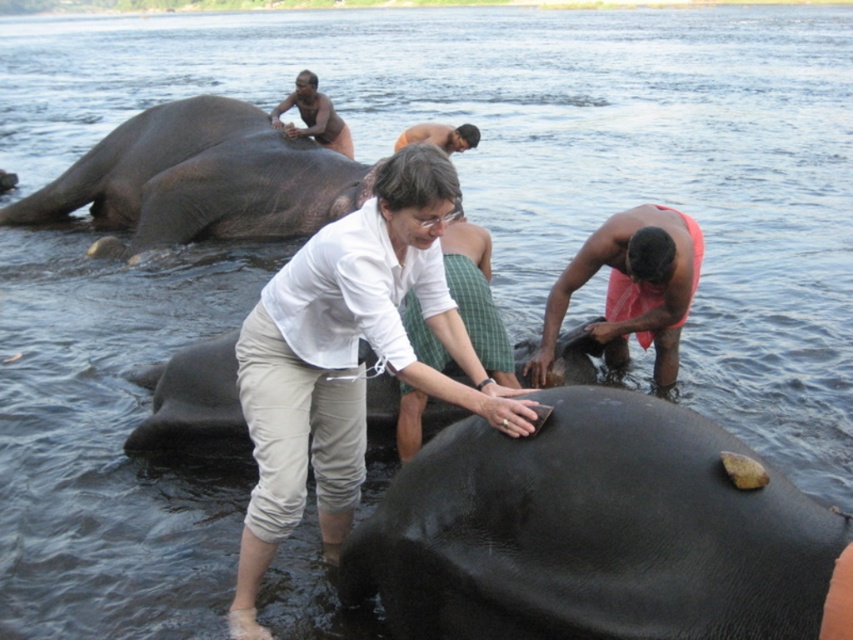
You are standing at the point labeled as point (276, 228) in the image. You want to move 5 meters forward. Will you still be within the scene depicted in the image?

The distance of point (276, 228) from viewer is 12.23 meters. Moving 5 meters forward would place you at 7.23 meters from the original viewpoint. Since the scene includes elements like the river, elephants, and people at varying distances, it is likely that moving 5 meters forward from point (276, 228) would still keep you within the depicted scene as the total depth seems sufficient.

You are a photographer trying to capture a photo of the shiny black skin at center and the brown skin man at upper center. Which subject should you zoom in more on to ensure both are in focus, considering their sizes?

The shiny black skin at center is wider than the brown skin man at upper center, so you should zoom in more on the shiny black skin at center to ensure both are in focus.

Based on the photo, you are a photographer trying to capture the shiny black skin at center and the gray matte elephant at upper left in the same frame. Based on their positions, which object should you focus on first to ensure both are in the frame?

The shiny black skin at center is located below the gray matte elephant at upper left, so you should focus on the gray matte elephant at upper left first to ensure both are in the frame.